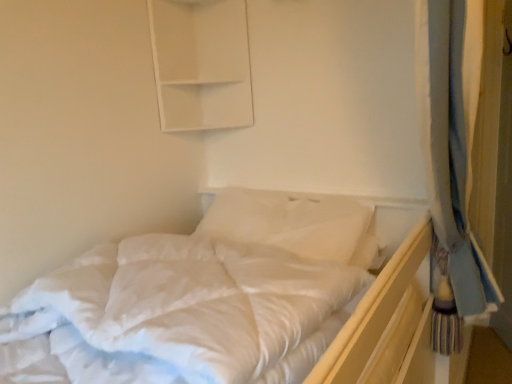
At what (x,y) coordinates should I click in order to perform the action: click on white soft bed at center. Please return your answer as a coordinate pair (x, y). The height and width of the screenshot is (384, 512). Looking at the image, I should click on (208, 295).

Describe the element at coordinates (208, 295) in the screenshot. I see `white soft bed at center` at that location.

What is the approximate width of white soft pillow at center?

14.81 inches.

Locate an element on the screen. white soft bed at center is located at coordinates (208, 295).

Considering the relative sizes of white soft bed at center and white matte cabinet at upper center in the image provided, is white soft bed at center smaller than white matte cabinet at upper center?

Incorrect, white soft bed at center is not smaller in size than white matte cabinet at upper center.

Locate an element on the screen. This screenshot has height=384, width=512. bed located in front of the white matte cabinet at upper center is located at coordinates coord(208,295).

Is point (207, 290) closer or farther from the camera than point (170, 125)?

Point (207, 290) appears to be closer to the viewer than point (170, 125).

Is white soft pillow at center turned away from white matte cabinet at upper center?

That's not correct — white soft pillow at center is not looking away from white matte cabinet at upper center.

Which object is more forward, white soft pillow at center or white matte cabinet at upper center?

white soft pillow at center is more forward.

From the image's perspective, is white soft pillow at center below white matte cabinet at upper center?

Yes, from the image's perspective, white soft pillow at center is below white matte cabinet at upper center.

From the image's perspective, between white soft pillow at center and white soft bed at center, which one is located above?

white soft pillow at center is shown above in the image.

Is point (365, 232) positioned before point (310, 209)?

Yes, point (365, 232) is closer to viewer.

Choose the correct answer: Is white soft pillow at center inside white soft bed at center or outside it?

white soft pillow at center exists outside the volume of white soft bed at center.

Which object is further away from the camera taking this photo, white matte cabinet at upper center or white soft pillow at center?

Positioned behind is white matte cabinet at upper center.

Looking at this image, considering the relative sizes of white matte cabinet at upper center and white soft pillow at center in the image provided, is white matte cabinet at upper center wider than white soft pillow at center?

Incorrect, the width of white matte cabinet at upper center does not surpass that of white soft pillow at center.

Does white matte cabinet at upper center have a greater height compared to white soft pillow at center?

Indeed, white matte cabinet at upper center has a greater height compared to white soft pillow at center.

Considering the sizes of white matte cabinet at upper center and white soft pillow at center in the image, is white matte cabinet at upper center bigger or smaller than white soft pillow at center?

Considering their sizes, white matte cabinet at upper center takes up less space than white soft pillow at center.

Is white soft bed at center oriented towards white soft pillow at center?

No, white soft bed at center is not aimed at white soft pillow at center.

Which of these two, white soft bed at center or white soft pillow at center, stands taller?

white soft pillow at center.

Does white soft bed at center have a smaller size compared to white soft pillow at center?

No, white soft bed at center is not smaller than white soft pillow at center.

Would you say white soft bed at center is outside white soft pillow at center?

That's correct, white soft bed at center is outside of white soft pillow at center.

Which object is wider, white matte cabinet at upper center or white soft bed at center?

With larger width is white soft bed at center.

From the image's perspective, is white matte cabinet at upper center on white soft bed at center?

Yes.

Can you confirm if white matte cabinet at upper center is shorter than white soft bed at center?

No.

Find the location of `medicine cabinet located on the right of white soft bed at center`. medicine cabinet located on the right of white soft bed at center is located at coordinates (201, 64).

Image resolution: width=512 pixels, height=384 pixels. In order to click on medicine cabinet on the left side of white soft pillow at center in this screenshot , I will do `click(201, 64)`.

From the image, which object appears to be nearer to white matte cabinet at upper center, white soft pillow at center or white soft bed at center?

white soft pillow at center is positioned closer to the anchor white matte cabinet at upper center.

Looking at the image, which one is located further to white soft bed at center, white matte cabinet at upper center or white soft pillow at center?

white matte cabinet at upper center is positioned further to the anchor white soft bed at center.

From the image, which object appears to be farther from white soft pillow at center, white soft bed at center or white matte cabinet at upper center?

Based on the image, white matte cabinet at upper center appears to be further to white soft pillow at center.

Estimate the real-world distances between objects in this image. Which object is further from white matte cabinet at upper center, white soft bed at center or white soft pillow at center?

white soft bed at center is further to white matte cabinet at upper center.

When comparing their distances from white soft pillow at center, does white matte cabinet at upper center or white soft bed at center seem further?

The object further to white soft pillow at center is white matte cabinet at upper center.

Considering their positions, is white soft pillow at center positioned further to white soft bed at center than white matte cabinet at upper center?

white matte cabinet at upper center.

Where is `pillow between white soft bed at center and white matte cabinet at upper center in the front-back direction`? The height and width of the screenshot is (384, 512). pillow between white soft bed at center and white matte cabinet at upper center in the front-back direction is located at coordinates (293, 223).